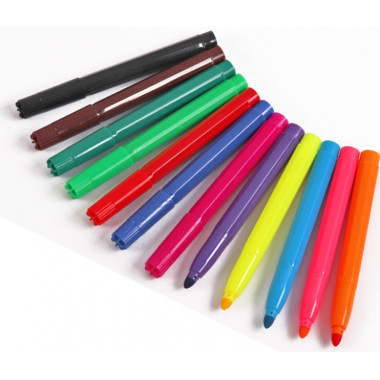
You are a GUI agent. You are given a task and a screenshot of the screen. Output one action in this format:
    pyautogui.click(x=<x>, y=<y>)
    Task: Click on the marker caps
    
    Given the screenshot: What is the action you would take?
    pyautogui.click(x=166, y=258), pyautogui.click(x=123, y=230), pyautogui.click(x=105, y=212), pyautogui.click(x=88, y=187), pyautogui.click(x=61, y=161), pyautogui.click(x=53, y=141), pyautogui.click(x=33, y=103)